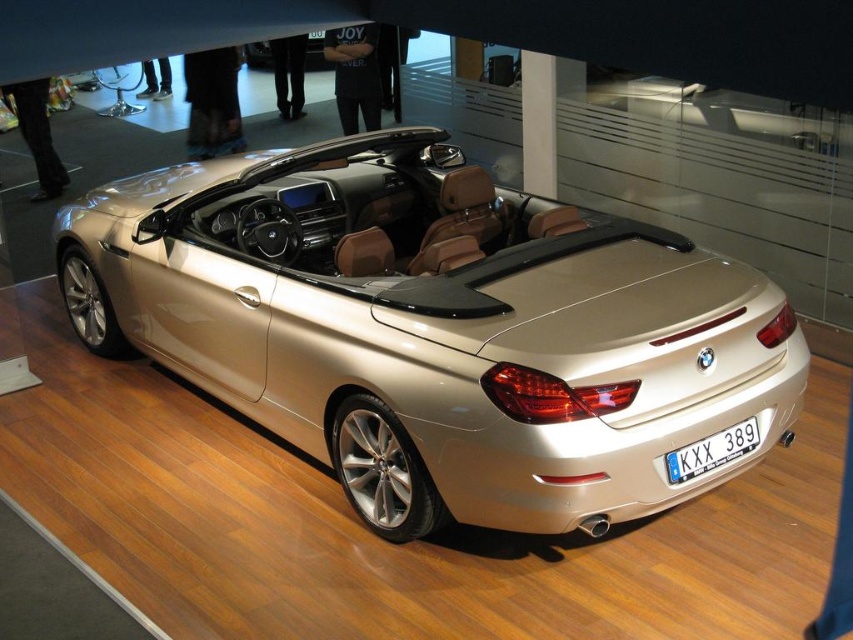
Question: Which point is closer to the camera taking this photo?

Choices:
 (A) (172, 220)
 (B) (715, 458)

Answer: (B)

Question: Which of the following is the closest to the observer?

Choices:
 (A) metallic gold convertible at center
 (B) white plastic license plate at center

Answer: (A)

Question: Does metallic gold convertible at center appear under white plastic license plate at center?

Choices:
 (A) yes
 (B) no

Answer: (B)

Question: Can you confirm if metallic gold convertible at center is positioned below white plastic license plate at center?

Choices:
 (A) no
 (B) yes

Answer: (A)

Question: Which point appears closest to the camera in this image?

Choices:
 (A) (714, 451)
 (B) (450, 484)

Answer: (A)

Question: Observing the image, what is the correct spatial positioning of metallic gold convertible at center in reference to white plastic license plate at center?

Choices:
 (A) left
 (B) right

Answer: (A)